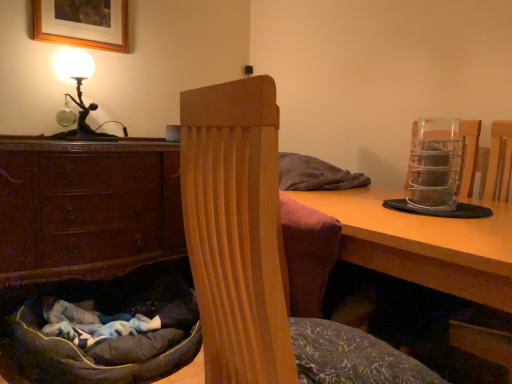
This screenshot has width=512, height=384. What do you see at coordinates (79, 93) in the screenshot?
I see `bronze/golden table lamp at upper left` at bounding box center [79, 93].

Locate an element on the screen. The image size is (512, 384). bronze/golden table lamp at upper left is located at coordinates (79, 93).

Where is `metallic wire mesh at right`? This screenshot has height=384, width=512. metallic wire mesh at right is located at coordinates (469, 155).

In order to face velvet-like brown bean bag chair at center, which ranks as the second bean bag chair in back-to-front order, should I rotate leftwards or rightwards?

Turn right by 10.711 degrees to look at velvet-like brown bean bag chair at center, which ranks as the second bean bag chair in back-to-front order.

This screenshot has width=512, height=384. Describe the element at coordinates (87, 207) in the screenshot. I see `brown wood chest of drawers at lower left` at that location.

Where is `wooden table at center`? The width and height of the screenshot is (512, 384). wooden table at center is located at coordinates (424, 244).

Where is `bronze/golden table lamp at upper left`? The width and height of the screenshot is (512, 384). bronze/golden table lamp at upper left is located at coordinates (79, 93).

From a real-world perspective, is velvet-like brown bean bag chair at center, which ranks as the 2th bean bag chair in left-to-right order, positioned above or below dark gray plush bean bag chair at lower left, which ranks as the first bean bag chair in back-to-front order?

In terms of real-world spatial position, velvet-like brown bean bag chair at center, which ranks as the 2th bean bag chair in left-to-right order, is above dark gray plush bean bag chair at lower left, which ranks as the first bean bag chair in back-to-front order.

In the image, is velvet-like brown bean bag chair at center, which ranks as the second bean bag chair in back-to-front order, on the left side or the right side of dark gray plush bean bag chair at lower left, which ranks as the first bean bag chair in back-to-front order?

From the image, it's evident that velvet-like brown bean bag chair at center, which ranks as the second bean bag chair in back-to-front order, is to the right of dark gray plush bean bag chair at lower left, which ranks as the first bean bag chair in back-to-front order.

Is velvet-like brown bean bag chair at center, which is counted as the 1th bean bag chair, starting from the right, directly adjacent to dark gray plush bean bag chair at lower left, acting as the first bean bag chair starting from the left?

No, velvet-like brown bean bag chair at center, which is counted as the 1th bean bag chair, starting from the right, is not making contact with dark gray plush bean bag chair at lower left, acting as the first bean bag chair starting from the left.

Considering the sizes of objects velvet-like brown bean bag chair at center, which is counted as the 1th bean bag chair, starting from the right, and dark gray plush bean bag chair at lower left, the second bean bag chair positioned from the front, in the image provided, who is taller, velvet-like brown bean bag chair at center, which is counted as the 1th bean bag chair, starting from the right, or dark gray plush bean bag chair at lower left, the second bean bag chair positioned from the front,?

velvet-like brown bean bag chair at center, which is counted as the 1th bean bag chair, starting from the right.

Looking at this image, between bronze/golden table lamp at upper left and wooden picture frame at upper left, which one has smaller size?

wooden picture frame at upper left is smaller.

This screenshot has width=512, height=384. I want to click on picture frame on the left of bronze/golden table lamp at upper left, so click(x=82, y=23).

Between bronze/golden table lamp at upper left and wooden picture frame at upper left, which one has smaller width?

wooden picture frame at upper left.

From the image's perspective, between bronze/golden table lamp at upper left and wooden picture frame at upper left, which one is located above?

wooden picture frame at upper left.

In terms of size, does metallic wire mesh at right appear bigger or smaller than bronze/golden table lamp at upper left?

Considering their sizes, metallic wire mesh at right takes up less space than bronze/golden table lamp at upper left.

Between metallic wire mesh at right and bronze/golden table lamp at upper left, which one has smaller width?

Thinner between the two is bronze/golden table lamp at upper left.

Is metallic wire mesh at right facing away from bronze/golden table lamp at upper left?

metallic wire mesh at right does not have its back to bronze/golden table lamp at upper left.

Considering the positions of objects metallic wire mesh at right and bronze/golden table lamp at upper left in the image provided, who is in front, metallic wire mesh at right or bronze/golden table lamp at upper left?

Positioned in front is metallic wire mesh at right.

Consider the image. How many degrees apart are the facing directions of velvet-like brown bean bag chair at center, which is counted as the 1th bean bag chair, starting from the right, and wooden picture frame at upper left?

81.4 degrees separate the facing orientations of velvet-like brown bean bag chair at center, which is counted as the 1th bean bag chair, starting from the right, and wooden picture frame at upper left.

Considering the relative sizes of velvet-like brown bean bag chair at center, which is counted as the 1th bean bag chair, starting from the right, and wooden picture frame at upper left in the image provided, is velvet-like brown bean bag chair at center, which is counted as the 1th bean bag chair, starting from the right, taller than wooden picture frame at upper left?

Correct, velvet-like brown bean bag chair at center, which is counted as the 1th bean bag chair, starting from the right, is much taller as wooden picture frame at upper left.

Considering the positions of points (225, 323) and (96, 16), is point (225, 323) farther from camera compared to point (96, 16)?

That is False.

Is velvet-like brown bean bag chair at center, which is the first bean bag chair in front-to-back order, in contact with wooden picture frame at upper left?

No, velvet-like brown bean bag chair at center, which is the first bean bag chair in front-to-back order, is not in contact with wooden picture frame at upper left.

How many degrees apart are the facing directions of velvet-like brown bean bag chair at center, which is the first bean bag chair in front-to-back order, and brown wood chest of drawers at lower left?

They differ by 83.1 degrees in their facing directions.

Considering the points (259, 234) and (4, 250), which point is behind, point (259, 234) or point (4, 250)?

Point (4, 250)

Is velvet-like brown bean bag chair at center, which ranks as the 2th bean bag chair in left-to-right order, to the right of brown wood chest of drawers at lower left from the viewer's perspective?

Correct, you'll find velvet-like brown bean bag chair at center, which ranks as the 2th bean bag chair in left-to-right order, to the right of brown wood chest of drawers at lower left.

From the image's perspective, is wooden picture frame at upper left above or below brown wood chest of drawers at lower left?

From the image's perspective, wooden picture frame at upper left appears above brown wood chest of drawers at lower left.

Between wooden picture frame at upper left and brown wood chest of drawers at lower left, which one has larger width?

brown wood chest of drawers at lower left is wider.

Considering the relative sizes of metallic wire mesh at right and velvet-like brown bean bag chair at center, which is the first bean bag chair in front-to-back order, in the image provided, is metallic wire mesh at right shorter than velvet-like brown bean bag chair at center, which is the first bean bag chair in front-to-back order,?

Yes, metallic wire mesh at right is shorter than velvet-like brown bean bag chair at center, which is the first bean bag chair in front-to-back order.

Considering the relative sizes of metallic wire mesh at right and velvet-like brown bean bag chair at center, which is counted as the 1th bean bag chair, starting from the right, in the image provided, is metallic wire mesh at right wider than velvet-like brown bean bag chair at center, which is counted as the 1th bean bag chair, starting from the right,?

Incorrect, the width of metallic wire mesh at right does not surpass that of velvet-like brown bean bag chair at center, which is counted as the 1th bean bag chair, starting from the right.

Is point (472, 172) positioned in front of point (190, 158)?

No.

Is metallic wire mesh at right in front of or behind velvet-like brown bean bag chair at center, which is the first bean bag chair in front-to-back order, in the image?

Visually, metallic wire mesh at right is located behind velvet-like brown bean bag chair at center, which is the first bean bag chair in front-to-back order.

Identify the location of bean bag chair above the dark gray plush bean bag chair at lower left, acting as the second bean bag chair starting from the right (from the image's perspective). Image resolution: width=512 pixels, height=384 pixels. (257, 254).

Find the location of a particular element. Image resolution: width=512 pixels, height=384 pixels. picture frame that appears above the bronze/golden table lamp at upper left (from a real-world perspective) is located at coordinates (82, 23).

When comparing their distances from bronze/golden table lamp at upper left, does velvet-like brown bean bag chair at center, which is the first bean bag chair in front-to-back order, or dark gray plush bean bag chair at lower left, which ranks as the first bean bag chair in back-to-front order, seem closer?

dark gray plush bean bag chair at lower left, which ranks as the first bean bag chair in back-to-front order, lies closer to bronze/golden table lamp at upper left than the other object.

Which object lies further to the anchor point bronze/golden table lamp at upper left, wooden picture frame at upper left or brown wood chest of drawers at lower left?

Based on the image, brown wood chest of drawers at lower left appears to be further to bronze/golden table lamp at upper left.

Considering their positions, is brown wood chest of drawers at lower left positioned further to dark gray plush bean bag chair at lower left, the second bean bag chair positioned from the front, than bronze/golden table lamp at upper left?

Among the two, bronze/golden table lamp at upper left is located further to dark gray plush bean bag chair at lower left, the second bean bag chair positioned from the front.

Which object lies nearer to the anchor point dark gray plush bean bag chair at lower left, acting as the first bean bag chair starting from the left, metallic wire mesh at right or velvet-like brown bean bag chair at center, which is counted as the 1th bean bag chair, starting from the right?

The object closer to dark gray plush bean bag chair at lower left, acting as the first bean bag chair starting from the left, is velvet-like brown bean bag chair at center, which is counted as the 1th bean bag chair, starting from the right.

Based on their spatial positions, is dark gray plush bean bag chair at lower left, acting as the second bean bag chair starting from the right, or velvet-like brown bean bag chair at center, which ranks as the second bean bag chair in back-to-front order, further from bronze/golden table lamp at upper left?

velvet-like brown bean bag chair at center, which ranks as the second bean bag chair in back-to-front order, is further to bronze/golden table lamp at upper left.

Estimate the real-world distances between objects in this image. Which object is closer to brown wood chest of drawers at lower left, bronze/golden table lamp at upper left or dark gray plush bean bag chair at lower left, acting as the second bean bag chair starting from the right?

The object closer to brown wood chest of drawers at lower left is dark gray plush bean bag chair at lower left, acting as the second bean bag chair starting from the right.

From the image, which object appears to be farther from wooden table at center, velvet-like brown bean bag chair at center, which is counted as the 1th bean bag chair, starting from the right, or metallic wire mesh at right?

Among the two, metallic wire mesh at right is located further to wooden table at center.

Considering their positions, is wooden table at center positioned further to metallic wire mesh at right than velvet-like brown bean bag chair at center, which ranks as the 2th bean bag chair in left-to-right order?

The object further to metallic wire mesh at right is velvet-like brown bean bag chair at center, which ranks as the 2th bean bag chair in left-to-right order.

At what (x,y) coordinates should I click in order to perform the action: click on bean bag chair located between dark gray plush bean bag chair at lower left, acting as the first bean bag chair starting from the left, and wooden table at center in the left-right direction. Please return your answer as a coordinate pair (x, y). Looking at the image, I should click on (257, 254).

You are a GUI agent. You are given a task and a screenshot of the screen. Output one action in this format:
    pyautogui.click(x=<x>, y=<y>)
    Task: Click on the armchair positioned between velvet-like brown bean bag chair at center, which ranks as the 2th bean bag chair in left-to-right order, and wooden picture frame at upper left from near to far
    
    Given the screenshot: What is the action you would take?
    pyautogui.click(x=469, y=155)

Find the location of a particular element. The width and height of the screenshot is (512, 384). bean bag chair between velvet-like brown bean bag chair at center, which is counted as the 1th bean bag chair, starting from the right, and wooden picture frame at upper left from front to back is located at coordinates (115, 338).

Identify the location of the chest of drawers situated between bronze/golden table lamp at upper left and wooden table at center from left to right. (87, 207).